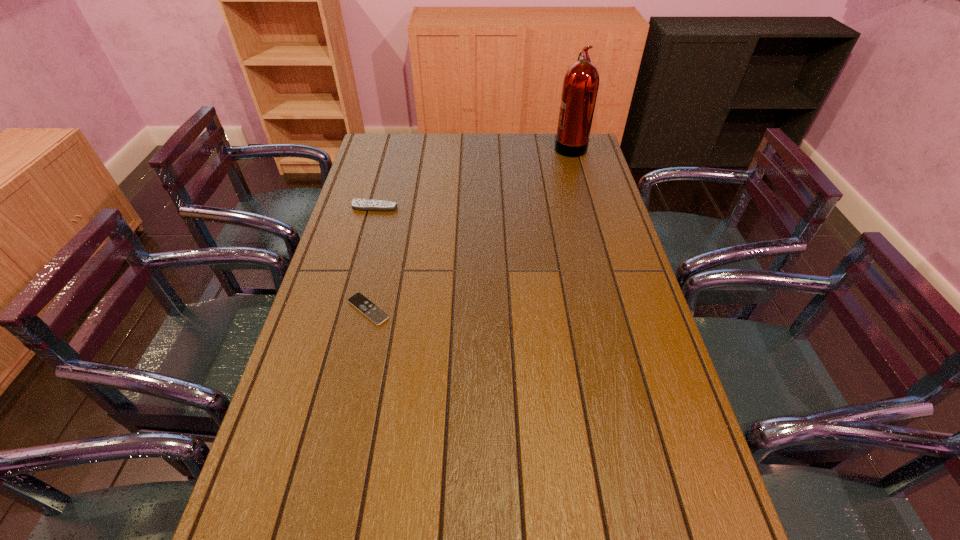
Find the location of a particular element. This screenshot has height=540, width=960. the tallest object is located at coordinates (580, 87).

Find the location of a particular element. the rightmost object is located at coordinates (580, 87).

Where is `the second shortest object`? The image size is (960, 540). the second shortest object is located at coordinates (358, 204).

Image resolution: width=960 pixels, height=540 pixels. Identify the location of the taller remote control. (358, 204).

Locate an element on the screen. This screenshot has height=540, width=960. the nearest object is located at coordinates (370, 310).

At what (x,y) coordinates should I click in order to perform the action: click on the shorter remote control. Please return your answer as a coordinate pair (x, y). Image resolution: width=960 pixels, height=540 pixels. Looking at the image, I should click on (370, 310).

Where is `vacant region located 0.250m on the front-facing side of the tallest object`? vacant region located 0.250m on the front-facing side of the tallest object is located at coordinates (493, 146).

Locate an element on the screen. Image resolution: width=960 pixels, height=540 pixels. vacant space located on the front-facing side of the tallest object is located at coordinates (510, 146).

Find the location of a particular element. The width and height of the screenshot is (960, 540). vacant region located 0.060m on the front-facing side of the tallest object is located at coordinates [539, 146].

Where is `vacant space located 0.120m on the front of the second shortest object`? Image resolution: width=960 pixels, height=540 pixels. vacant space located 0.120m on the front of the second shortest object is located at coordinates (367, 234).